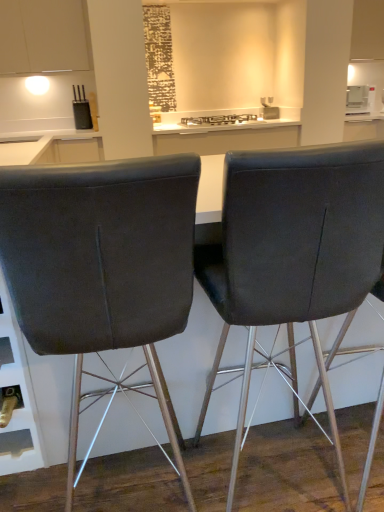
Question: In the image, is metallic silver gas stove at center positioned in front of or behind dark gray fabric chair at center, which is the 1th chair in left-to-right order?

Choices:
 (A) front
 (B) behind

Answer: (B)

Question: Looking at the image, does metallic silver gas stove at center seem bigger or smaller compared to dark gray fabric chair at center, which is counted as the 2th chair, starting from the right?

Choices:
 (A) small
 (B) big

Answer: (A)

Question: Which is nearer to the matte black chair at center, the 1th chair from the right?

Choices:
 (A) white glossy microwave at upper right
 (B) dark gray fabric chair at center, which is counted as the 2th chair, starting from the right
 (C) metallic silver gas stove at center
 (D) white matte cabinet at upper left

Answer: (B)

Question: Considering the real-world distances, which object is closest to the matte black chair at center, placed as the 2th chair when sorted from left to right?

Choices:
 (A) dark gray fabric chair at center, which is the 1th chair in left-to-right order
 (B) metallic silver gas stove at center
 (C) white matte cabinet at upper left
 (D) white glossy microwave at upper right

Answer: (A)